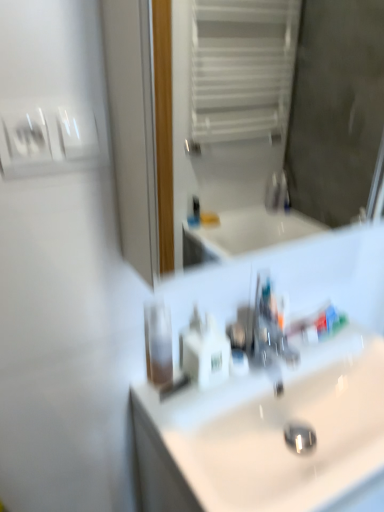
Find the location of `vacant area in front of white plastic soap dispenser at center`. vacant area in front of white plastic soap dispenser at center is located at coordinates (201, 416).